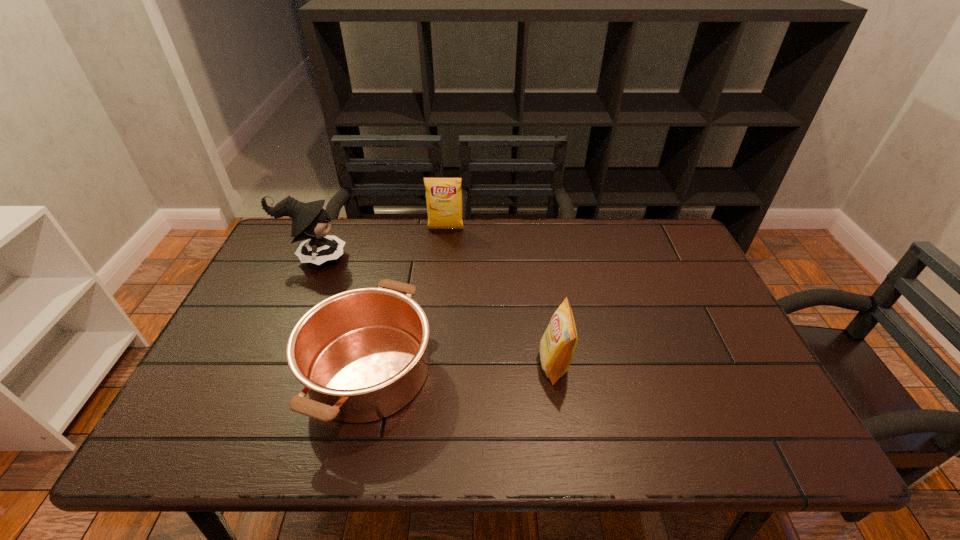
Find the location of `free space located on the front-facing side of the nearer crisp (potato chip)`. free space located on the front-facing side of the nearer crisp (potato chip) is located at coordinates (486, 364).

Where is `vacant space situated 0.110m on the back of the saucepan`? This screenshot has width=960, height=540. vacant space situated 0.110m on the back of the saucepan is located at coordinates (389, 283).

In order to click on doll situated at the far edge in this screenshot , I will do (310, 221).

Identify the location of crisp (potato chip) at the far edge. (443, 195).

I want to click on object at the near edge, so click(x=361, y=354).

This screenshot has height=540, width=960. Find the location of `object that is at the left edge`. object that is at the left edge is located at coordinates (310, 221).

Where is `object located at the far left corner`? This screenshot has width=960, height=540. object located at the far left corner is located at coordinates (310, 221).

Find the location of `vacant space at the far edge of the desktop`. vacant space at the far edge of the desktop is located at coordinates (498, 225).

Locate an element on the screen. This screenshot has width=960, height=540. vacant space at the near edge of the desktop is located at coordinates (447, 440).

Locate an element on the screen. Image resolution: width=960 pixels, height=540 pixels. vacant space at the left edge of the desktop is located at coordinates (200, 376).